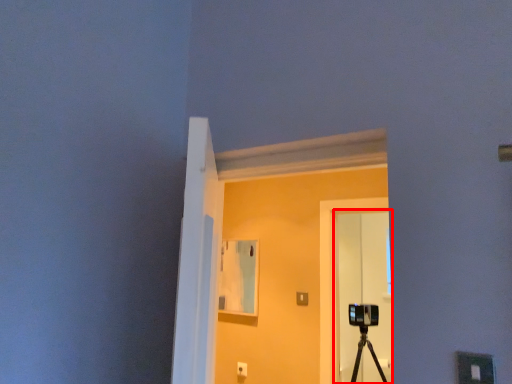
Question: Where is glass door (annotated by the red box) located in relation to window in the image?

Choices:
 (A) left
 (B) right

Answer: (B)